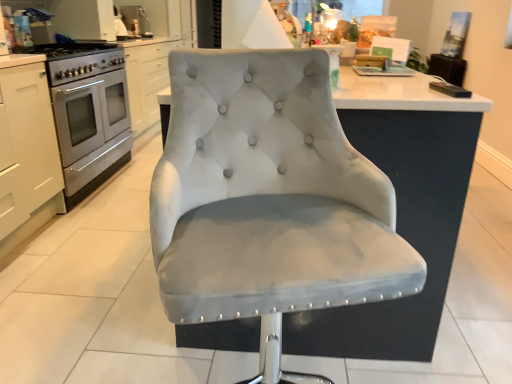
Question: Is satin silver gas stove at left at the right side of white matte cabinet at left?

Choices:
 (A) no
 (B) yes

Answer: (B)

Question: Is satin silver gas stove at left thinner than white matte cabinet at left?

Choices:
 (A) no
 (B) yes

Answer: (A)

Question: From a real-world perspective, is satin silver gas stove at left positioned under white matte cabinet at left based on gravity?

Choices:
 (A) no
 (B) yes

Answer: (A)

Question: Considering the relative sizes of satin silver gas stove at left and white matte cabinet at left in the image provided, is satin silver gas stove at left bigger than white matte cabinet at left?

Choices:
 (A) no
 (B) yes

Answer: (A)

Question: Is satin silver gas stove at left directly adjacent to white matte cabinet at left?

Choices:
 (A) no
 (B) yes

Answer: (A)

Question: Considering the positions of satin silver gas stove at left and suede-like gray chair at center in the image, is satin silver gas stove at left wider or thinner than suede-like gray chair at center?

Choices:
 (A) thin
 (B) wide

Answer: (A)

Question: From the image's perspective, relative to suede-like gray chair at center, is satin silver gas stove at left above or below?

Choices:
 (A) below
 (B) above

Answer: (B)

Question: Is point (47, 66) positioned closer to the camera than point (194, 284)?

Choices:
 (A) farther
 (B) closer

Answer: (A)

Question: Is satin silver gas stove at left taller or shorter than suede-like gray chair at center?

Choices:
 (A) tall
 (B) short

Answer: (B)

Question: Is point (22, 160) positioned closer to the camera than point (112, 66)?

Choices:
 (A) farther
 (B) closer

Answer: (B)

Question: In terms of width, does white matte cabinet at left look wider or thinner when compared to satin silver gas stove at left?

Choices:
 (A) wide
 (B) thin

Answer: (B)

Question: Considering the positions of white matte cabinet at left and satin silver gas stove at left in the image, is white matte cabinet at left taller or shorter than satin silver gas stove at left?

Choices:
 (A) short
 (B) tall

Answer: (B)

Question: From a real-world perspective, is white matte cabinet at left above or below satin silver gas stove at left?

Choices:
 (A) above
 (B) below

Answer: (B)

Question: Is suede-like gray chair at center in front of or behind satin silver oven at left in the image?

Choices:
 (A) behind
 (B) front

Answer: (B)

Question: Considering the positions of point (387, 192) and point (112, 97), is point (387, 192) closer or farther from the camera than point (112, 97)?

Choices:
 (A) farther
 (B) closer

Answer: (B)